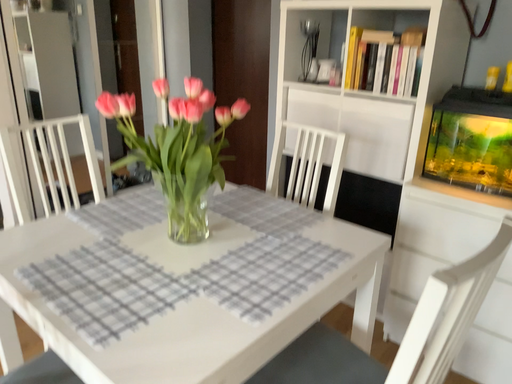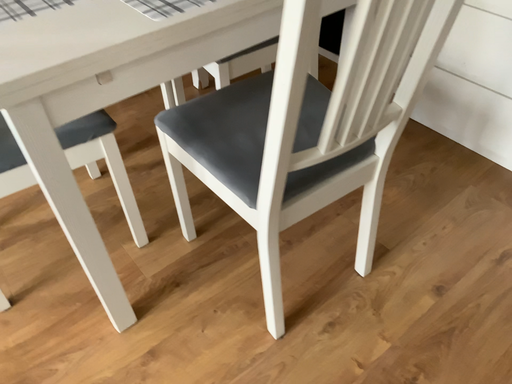
Question: How did the camera likely rotate when shooting the video?

Choices:
 (A) rotated downward
 (B) rotated upward

Answer: (A)